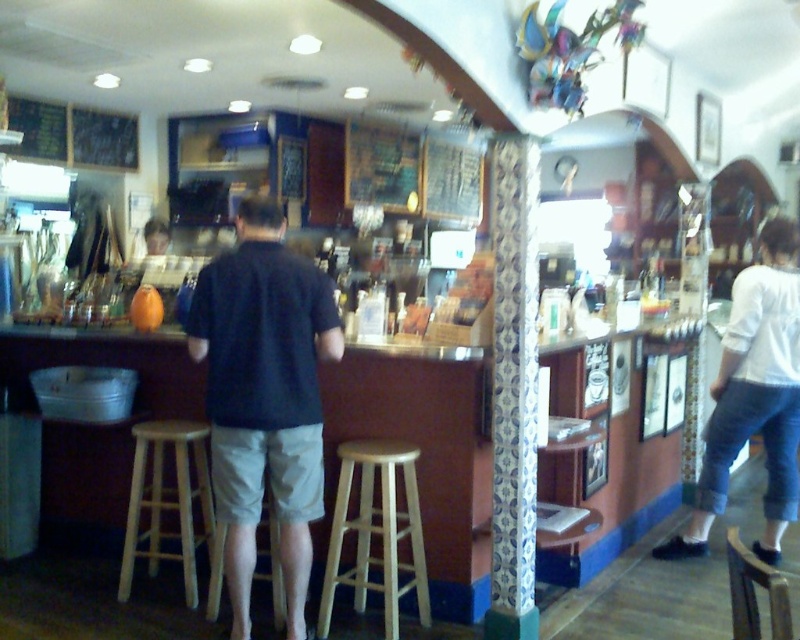
Question: Considering the real-world distances, which object is farthest from the dark blue shirt at center?

Choices:
 (A) wooden at left
 (B) blue and white patterned column at center

Answer: (B)

Question: Which of these objects is positioned closest to the light wood bar stool at center?

Choices:
 (A) light brown wooden stool at center
 (B) wooden at left

Answer: (B)

Question: Is blue and white patterned column at center bigger than light wood bar stool at center?

Choices:
 (A) no
 (B) yes

Answer: (A)

Question: Is dark blue shirt at center thinner than blue and white patterned column at center?

Choices:
 (A) no
 (B) yes

Answer: (A)

Question: Estimate the real-world distances between objects in this image. Which object is closer to the dark blue shirt at center?

Choices:
 (A) white cotton shirt at right
 (B) light wood bar stool at center
 (C) light brown wooden stool at center
 (D) blue and white patterned column at center

Answer: (B)

Question: In this image, where is white cotton shirt at right located relative to light wood bar stool at center?

Choices:
 (A) right
 (B) left

Answer: (A)